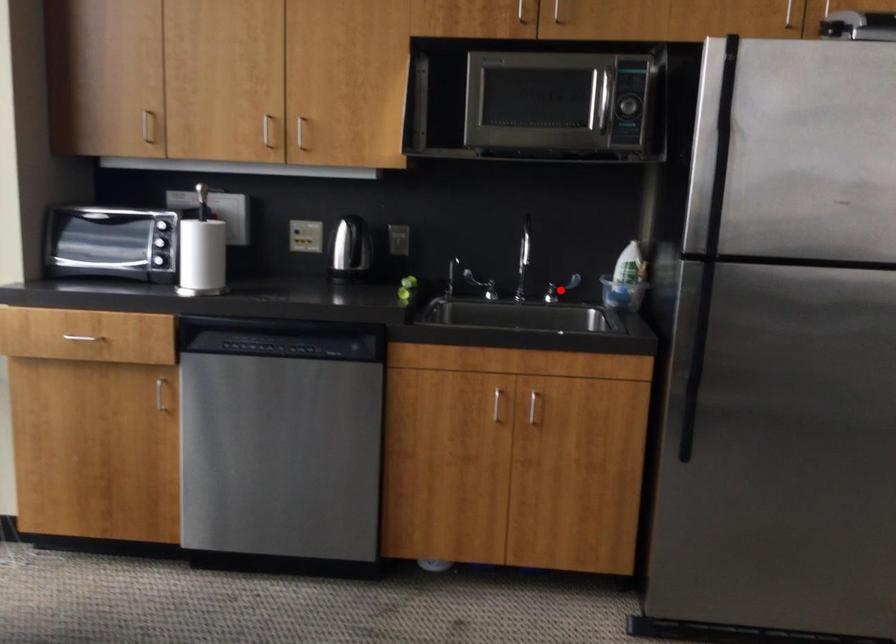
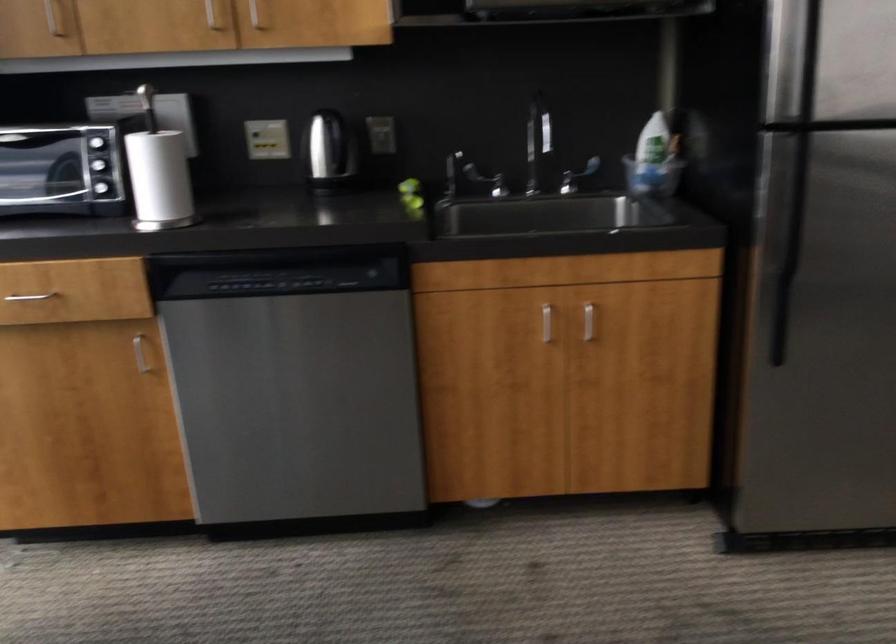
Locate, in the second image, the point that corresponds to the highlighted location in the first image.

(576, 176)